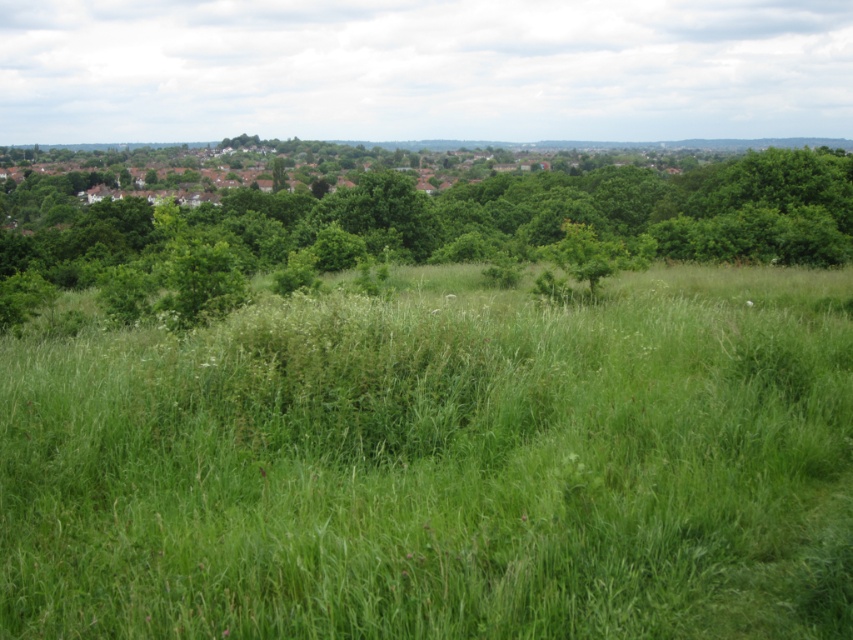
The image size is (853, 640). I want to click on green grassy field at center, so click(442, 465).

Looking at this image, who is more distant from viewer, (450, 557) or (96, 234)?

Point (96, 234)

The image size is (853, 640). What do you see at coordinates (442, 465) in the screenshot? I see `green grassy field at center` at bounding box center [442, 465].

This screenshot has height=640, width=853. I want to click on green grassy field at center, so click(x=442, y=465).